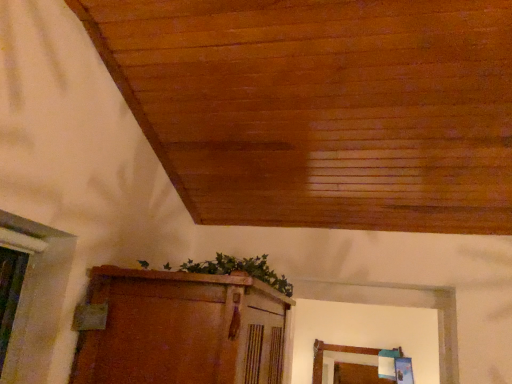
In order to click on green leafy plant at center in this screenshot , I will do `click(240, 270)`.

The width and height of the screenshot is (512, 384). What do you see at coordinates (240, 270) in the screenshot?
I see `green leafy plant at center` at bounding box center [240, 270].

You are a GUI agent. You are given a task and a screenshot of the screen. Output one action in this format:
    pyautogui.click(x=<x>, y=<y>)
    Task: Click on the green leafy plant at center
    Image resolution: width=512 pixels, height=384 pixels.
    Given the screenshot: What is the action you would take?
    pyautogui.click(x=240, y=270)